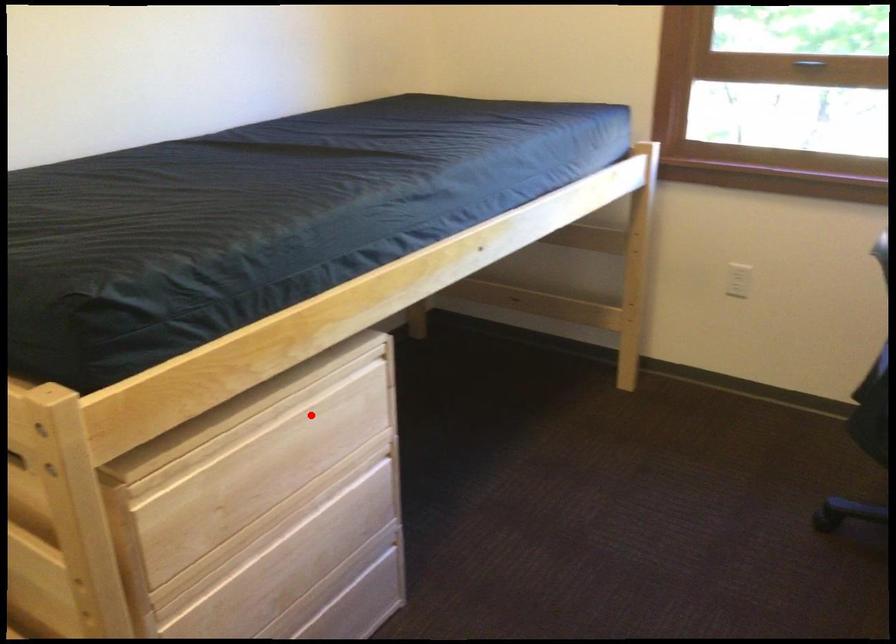
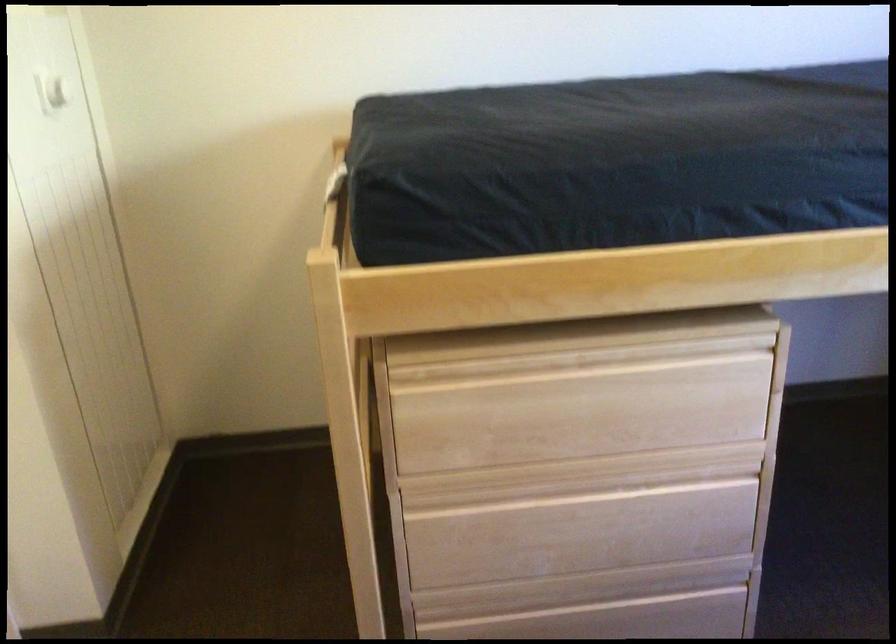
Question: I am providing you with two images of the same scene from different viewpoints. Image1 has a red point marked. In image2, the corresponding 3D location appears at what relative position? Reply with the corresponding letter.

Choices:
 (A) Closer
 (B) Farther

Answer: (A)